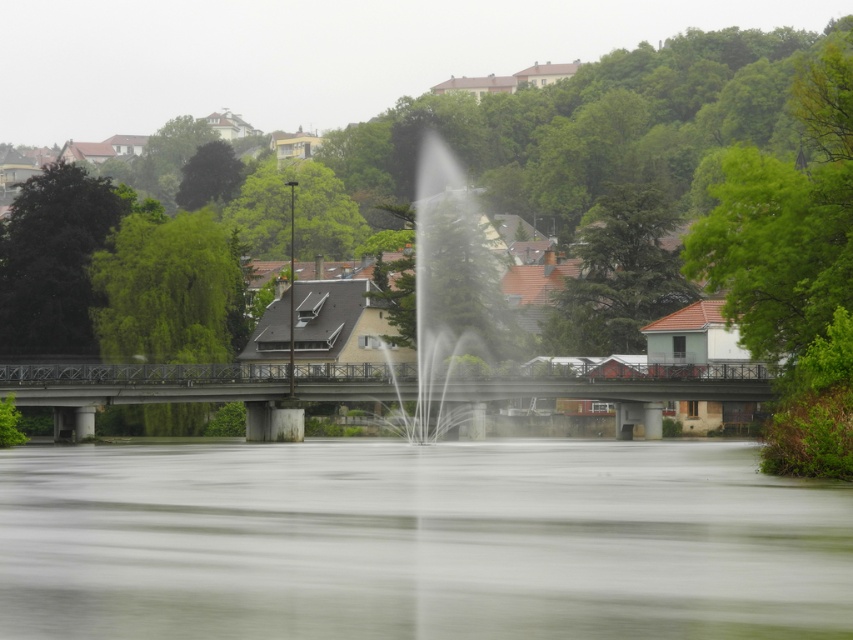
You are a bird flying over the riverside scene. You want to land on the tallest object between the green leafy tree at center and the concrete bridge at center. Which one should you choose?

The green leafy tree at center is much taller than the concrete bridge at center, so you should land on the green leafy tree at center.

You are standing on the bridge and want to know which tree is taller between the green leafy tree at center and the green textured tree at center. Which one is taller?

The green leafy tree at center is taller than the green textured tree at center.